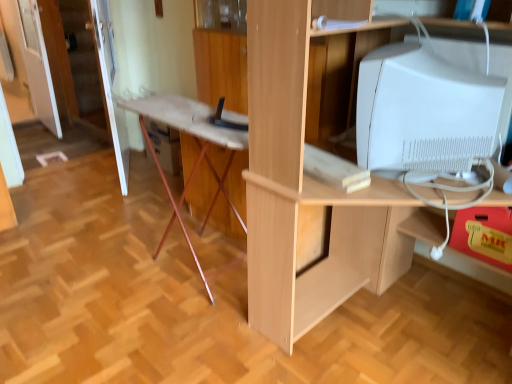
Question: Considering the positions of white glossy door at upper left, which is counted as the first door, starting from the right, and white glossy computer monitor at upper right in the image, is white glossy door at upper left, which is counted as the first door, starting from the right, taller or shorter than white glossy computer monitor at upper right?

Choices:
 (A) short
 (B) tall

Answer: (B)

Question: Based on their positions, is white glossy door at upper left, which is counted as the first door, starting from the right, located to the left or right of white glossy computer monitor at upper right?

Choices:
 (A) left
 (B) right

Answer: (A)

Question: Based on their relative distances, which object is nearer to the transparent glass door at upper left?

Choices:
 (A) light wood desk at center
 (B) yellow matte drawer at lower right
 (C) white glossy door at upper left, marked as the 2th door in a right-to-left arrangement
 (D) white glossy door at upper left, which is counted as the first door, starting from the right
 (E) white glossy computer monitor at upper right

Answer: (C)

Question: Based on their relative distances, which object is farther from the yellow matte drawer at lower right?

Choices:
 (A) wooden ironing board at center
 (B) white glossy computer monitor at upper right
 (C) transparent glass door at upper left
 (D) light wood desk at center
 (E) white glossy door at upper left, which is counted as the first door, starting from the right

Answer: (C)